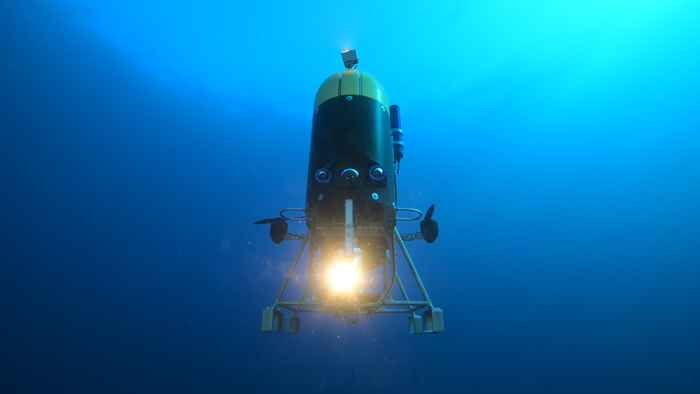
Where is `bright light`? The height and width of the screenshot is (394, 700). bright light is located at coordinates (344, 280).